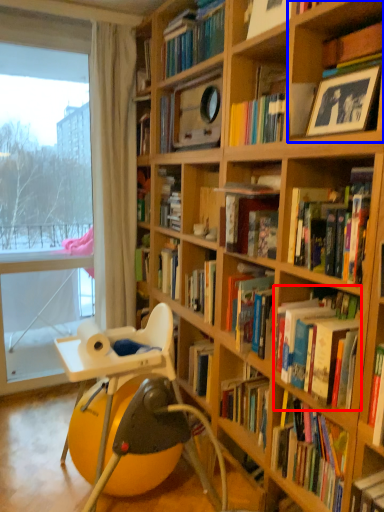
Question: Among these objects, which one is nearest to the camera, book (highlighted by a red box) or shelf (highlighted by a blue box)?

Choices:
 (A) book
 (B) shelf

Answer: (B)